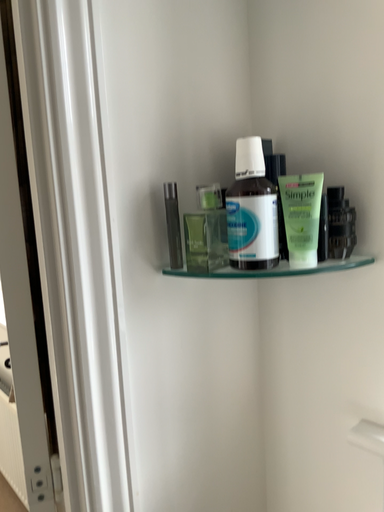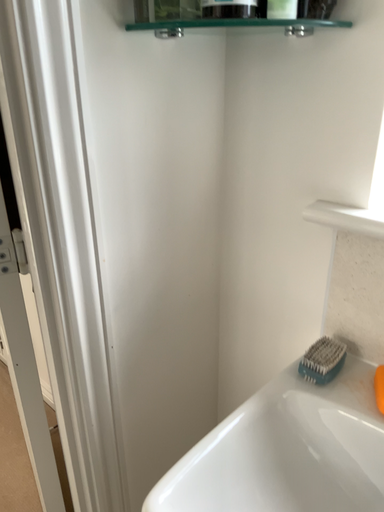
Question: How did the camera likely rotate when shooting the video?

Choices:
 (A) rotated left
 (B) rotated right

Answer: (B)